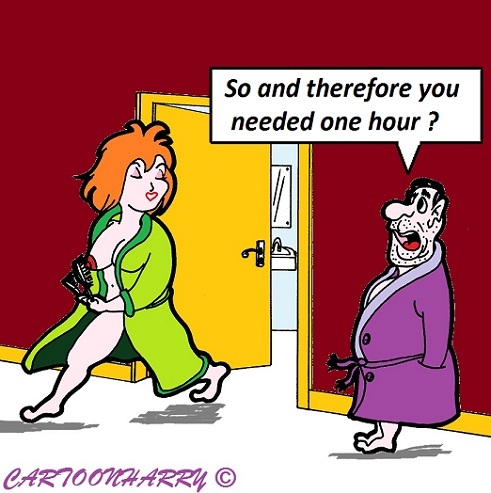
Where is `door handle`? This screenshot has height=493, width=491. door handle is located at coordinates (259, 249).